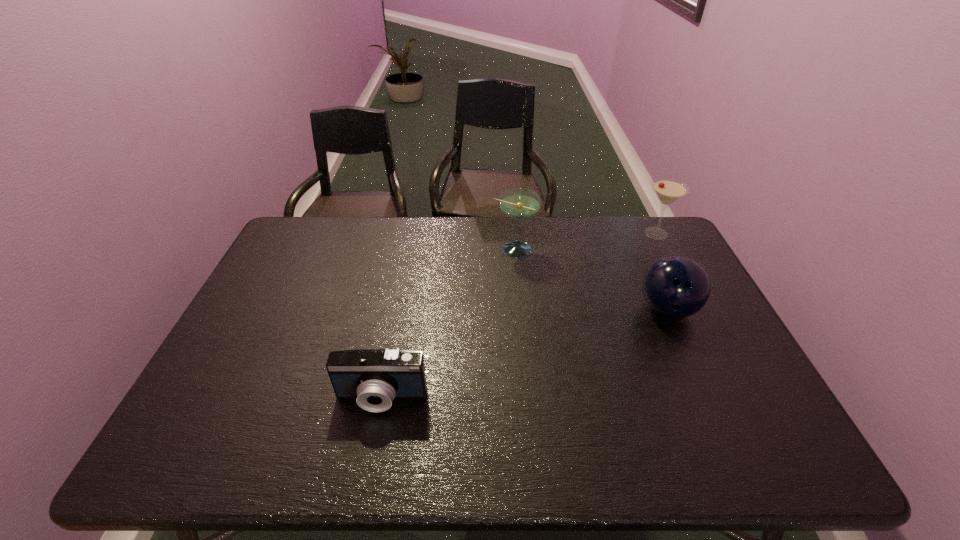
In order to click on bowling ball situated at the right edge in this screenshot , I will do `click(676, 287)`.

Find the location of `object at the far right corner`. object at the far right corner is located at coordinates (668, 190).

The height and width of the screenshot is (540, 960). What are the coordinates of `free space at the far edge of the desktop` in the screenshot? It's located at (375, 238).

At what (x,y) coordinates should I click in order to perform the action: click on vacant area at the left edge. Please return your answer as a coordinate pair (x, y). Looking at the image, I should click on (275, 320).

The height and width of the screenshot is (540, 960). In the image, there is a desktop. Identify the location of vacant space at the right edge. (739, 396).

This screenshot has width=960, height=540. I want to click on vacant space at the far right corner of the desktop, so click(x=663, y=251).

Locate an element on the screen. free spot between the second nearest object and the shortest object is located at coordinates (524, 354).

Image resolution: width=960 pixels, height=540 pixels. In order to click on free point between the shortest object and the left martini in this screenshot , I will do `click(447, 323)`.

Find the location of `unoccupied position between the leftmost object and the left martini`. unoccupied position between the leftmost object and the left martini is located at coordinates (447, 323).

The image size is (960, 540). Identify the location of free area in between the bowling ball and the camcorder. (524, 354).